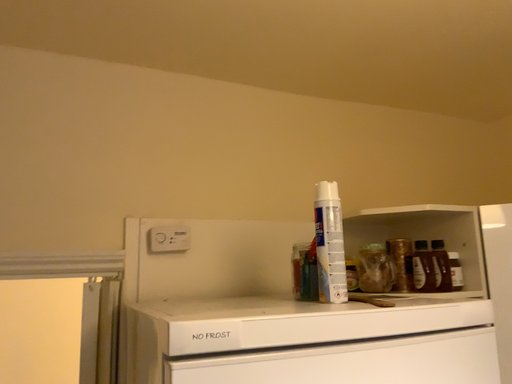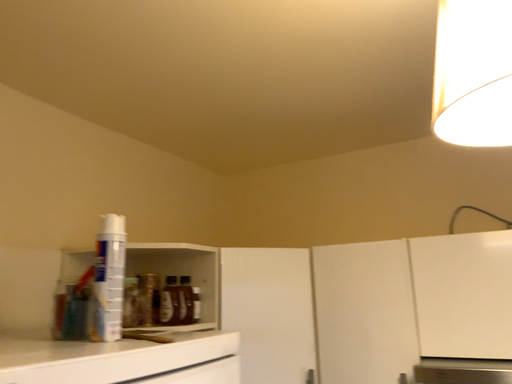
Question: Which way did the camera rotate in the video?

Choices:
 (A) rotated right
 (B) rotated left

Answer: (A)